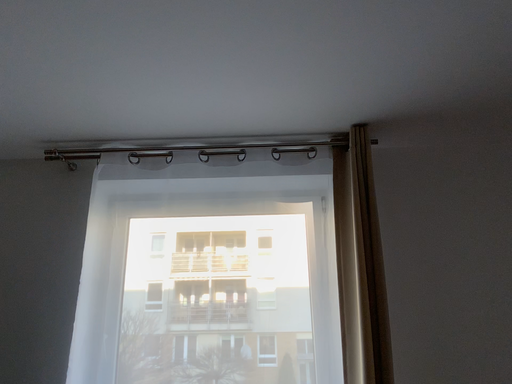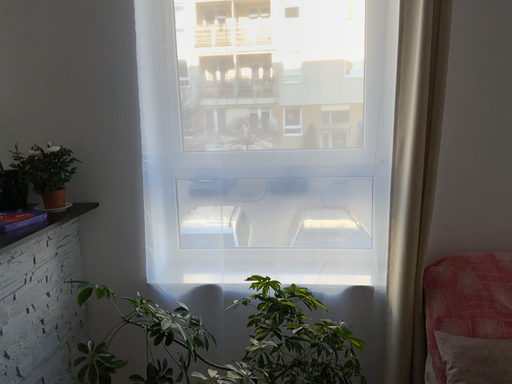
Question: Which way did the camera rotate in the video?

Choices:
 (A) rotated upward
 (B) rotated downward

Answer: (B)